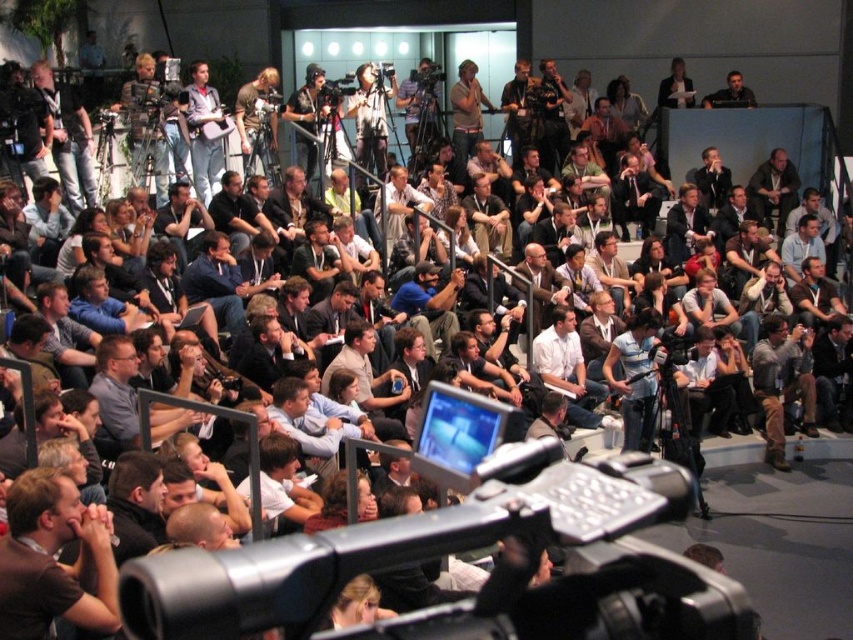
Does black plastic video camera at center appear under light brown leather jacket at center?

Actually, black plastic video camera at center is above light brown leather jacket at center.

Is point (630, 547) positioned after point (808, 433)?

No.

The width and height of the screenshot is (853, 640). Identify the location of black plastic video camera at center. (456, 550).

What do you see at coordinates (456, 550) in the screenshot?
I see `black plastic video camera at center` at bounding box center [456, 550].

How far apart are black plastic video camera at center and light brown hair at lower left?

black plastic video camera at center and light brown hair at lower left are 5.39 meters apart from each other.

Between point (680, 572) and point (96, 618), which one is positioned in front?

Point (680, 572)

What are the coordinates of `black plastic video camera at center` in the screenshot? It's located at (456, 550).

The image size is (853, 640). What do you see at coordinates (456, 550) in the screenshot?
I see `black plastic video camera at center` at bounding box center [456, 550].

Does black plastic video camera at center have a lesser width compared to gray shirt at center?

Incorrect, black plastic video camera at center's width is not less than gray shirt at center's.

Who is more distant from viewer, [314,545] or [167,419]?

The point [167,419] is more distant.

You are a GUI agent. You are given a task and a screenshot of the screen. Output one action in this format:
    pyautogui.click(x=<x>, y=<y>)
    Task: Click on the black plastic video camera at center
    The image size is (853, 640).
    Given the screenshot: What is the action you would take?
    pyautogui.click(x=456, y=550)